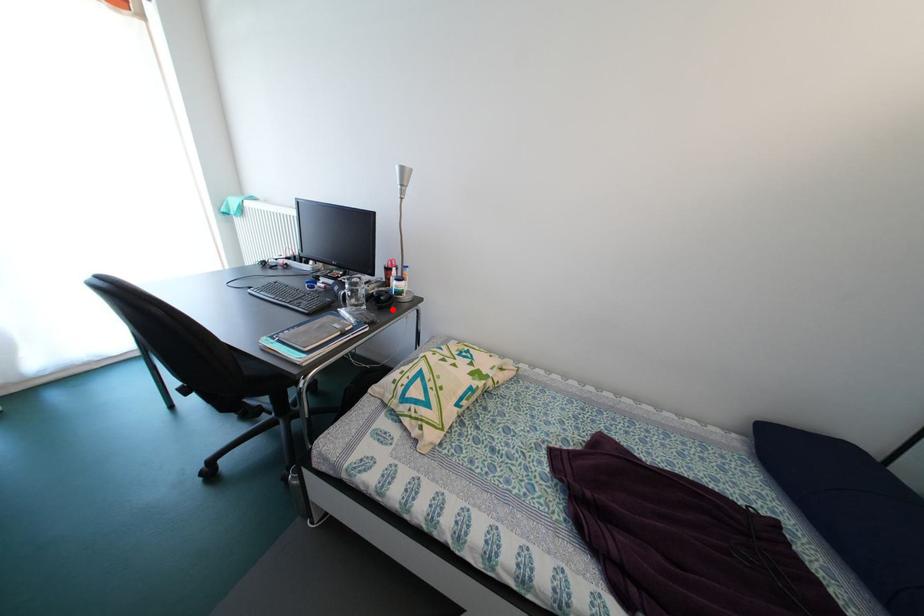
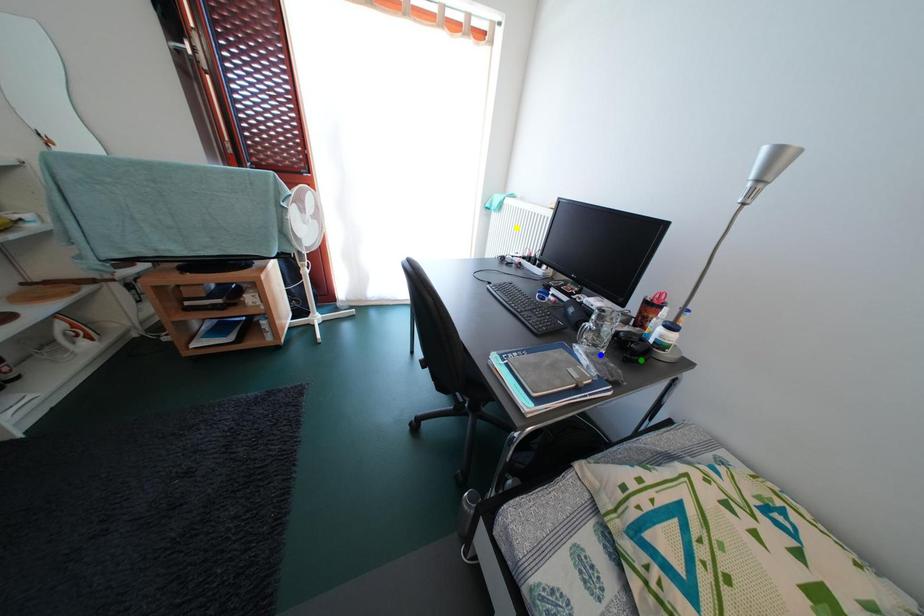
Question: I am providing you with two images of the same scene from different viewpoints. A red point is marked on the first image. You are given multiple points on the second image. Which mark in image 2 goes with the point in image 1?

Choices:
 (A) green point
 (B) yellow point
 (C) blue point

Answer: (A)